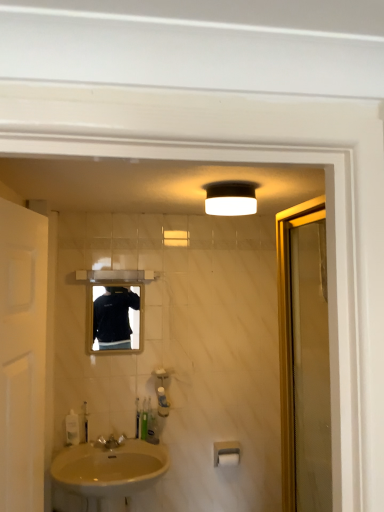
The width and height of the screenshot is (384, 512). I want to click on vacant area that lies between silver metallic faucet at lower center and clear plastic bottle at lower left, which ranks as the fifth toiletry in right-to-left order, so click(84, 446).